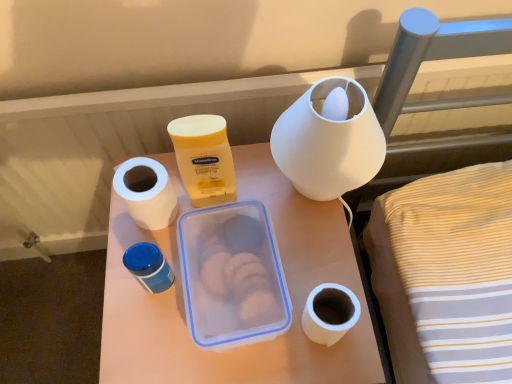
The height and width of the screenshot is (384, 512). Identify the location of free location to the left of white matte toilet paper at lower right. (218, 328).